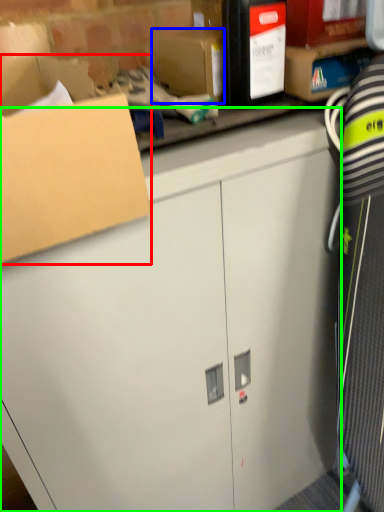
Question: Which is farther away from box (highlighted by a red box)? storage box (highlighted by a blue box) or cabinetry (highlighted by a green box)?

Choices:
 (A) storage box
 (B) cabinetry

Answer: (B)